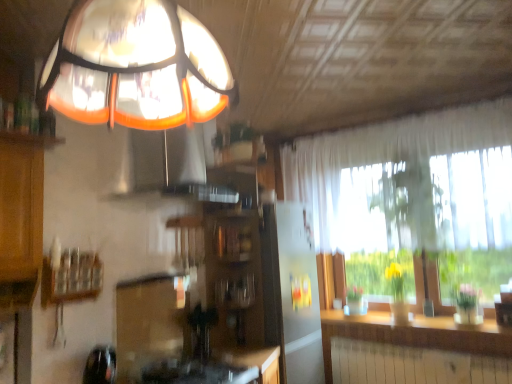
Question: From a real-world perspective, is wooden shelf at left beneath wooden cabinet at center?

Choices:
 (A) yes
 (B) no

Answer: (A)

Question: Is wooden shelf at left to the right of wooden cabinet at center from the viewer's perspective?

Choices:
 (A) yes
 (B) no

Answer: (B)

Question: Is wooden cabinet at center completely or partially inside wooden shelf at left?

Choices:
 (A) no
 (B) yes

Answer: (A)

Question: Is the depth of wooden shelf at left less than that of wooden cabinet at center?

Choices:
 (A) yes
 (B) no

Answer: (A)

Question: Is wooden shelf at left not within wooden cabinet at center?

Choices:
 (A) yes
 (B) no

Answer: (A)

Question: From a real-world perspective, is wooden shelf at left physically above wooden cabinet at center?

Choices:
 (A) no
 (B) yes

Answer: (A)

Question: Considering the relative sizes of orange glass exhaust hood at upper center and translucent glass lampshade at upper center in the image provided, is orange glass exhaust hood at upper center taller than translucent glass lampshade at upper center?

Choices:
 (A) no
 (B) yes

Answer: (B)

Question: Can you confirm if orange glass exhaust hood at upper center is positioned to the right of translucent glass lampshade at upper center?

Choices:
 (A) no
 (B) yes

Answer: (A)

Question: Is orange glass exhaust hood at upper center at the left side of translucent glass lampshade at upper center?

Choices:
 (A) no
 (B) yes

Answer: (B)

Question: From the image's perspective, would you say orange glass exhaust hood at upper center is shown under translucent glass lampshade at upper center?

Choices:
 (A) yes
 (B) no

Answer: (A)

Question: Is orange glass exhaust hood at upper center wider than translucent glass lampshade at upper center?

Choices:
 (A) yes
 (B) no

Answer: (B)

Question: From a real-world perspective, is orange glass exhaust hood at upper center under translucent glass lampshade at upper center?

Choices:
 (A) no
 (B) yes

Answer: (A)

Question: Is translucent glass lampshade at upper center turned away from orange glass exhaust hood at upper center?

Choices:
 (A) no
 (B) yes

Answer: (A)